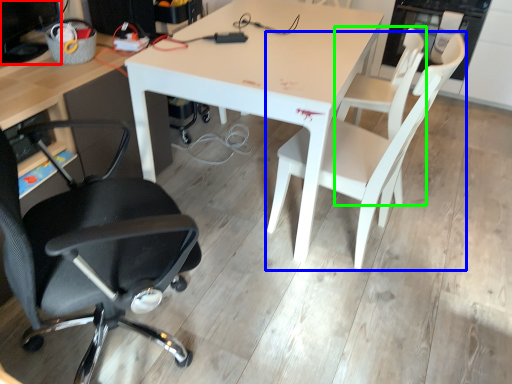
Question: Considering the real-world distances, which object is farthest from computer monitor (highlighted by a red box)? chair (highlighted by a blue box) or chair (highlighted by a green box)?

Choices:
 (A) chair
 (B) chair

Answer: (B)